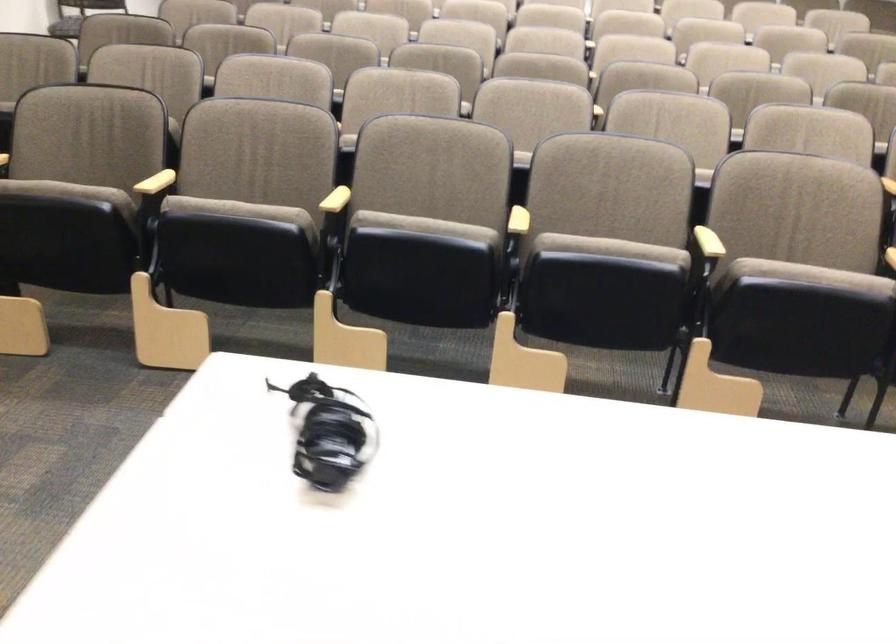
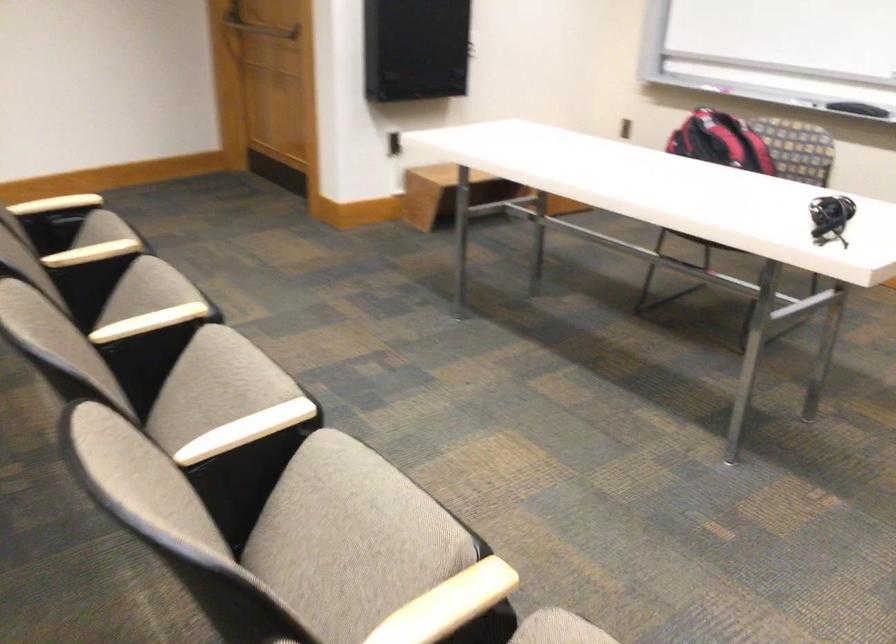
Where in the second image is the point corresponding to point 699,239 from the first image?

(149, 322)